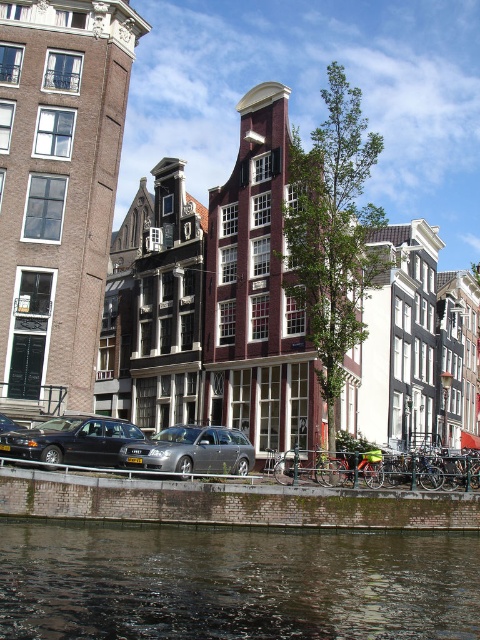
You are a delivery driver who needs to park your vehicle in this area. You see a shiny black sedan at lower left and a metallic gray wagon at center. Which vehicle takes up more parking space?

The metallic gray wagon at center takes up more parking space than the shiny black sedan at lower left because the shiny black sedan at lower left occupies less space than metallic gray wagon at center.

You are standing at the point marked as point (385, 557) in the image. You want to walk to the nearest building. Which building is closest to you?

The nearest building to point (385, 557) is the deep red brick building with a white framed window, as it is the closest structure to the point in the scene.

You are standing at the point with coordinates (72,440) in the image. What object is located at this position?

The point at coordinates (72,440) corresponds to the shiny black sedan at lower left.